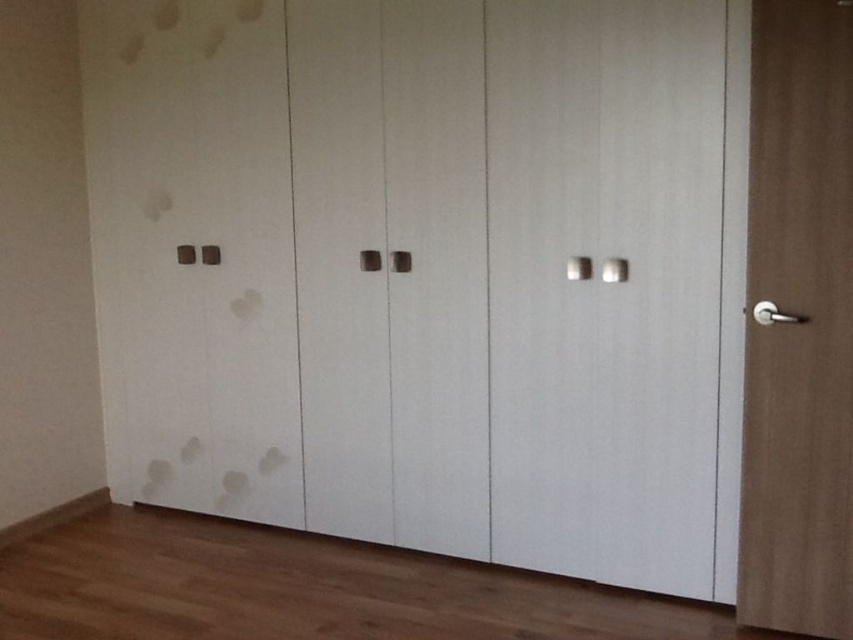
Does point (699, 388) come behind point (752, 561)?

That is True.

Does white matte door at center appear on the left side of brown wood door at right?

Indeed, white matte door at center is positioned on the left side of brown wood door at right.

Measure the distance between point (535, 529) and camera.

Point (535, 529) is 2.92 meters from camera.

Locate an element on the screen. This screenshot has height=640, width=853. white matte door at center is located at coordinates (605, 285).

Does matte white door at left lie behind brown wood door at right?

Yes, it is.

Can you confirm if matte white door at left is thinner than brown wood door at right?

Incorrect, matte white door at left's width is not less than brown wood door at right's.

Between point (135, 308) and point (824, 192), which one is positioned in front?

Point (824, 192)

Where is `matte white door at left`? This screenshot has width=853, height=640. matte white door at left is located at coordinates (193, 252).

Can you confirm if white matte door at center is positioned to the right of matte white door at left?

Correct, you'll find white matte door at center to the right of matte white door at left.

Is white matte door at center positioned at the back of matte white door at left?

That is False.

Describe the element at coordinates (605, 285) in the screenshot. I see `white matte door at center` at that location.

Locate an element on the screen. Image resolution: width=853 pixels, height=640 pixels. white matte door at center is located at coordinates (605, 285).